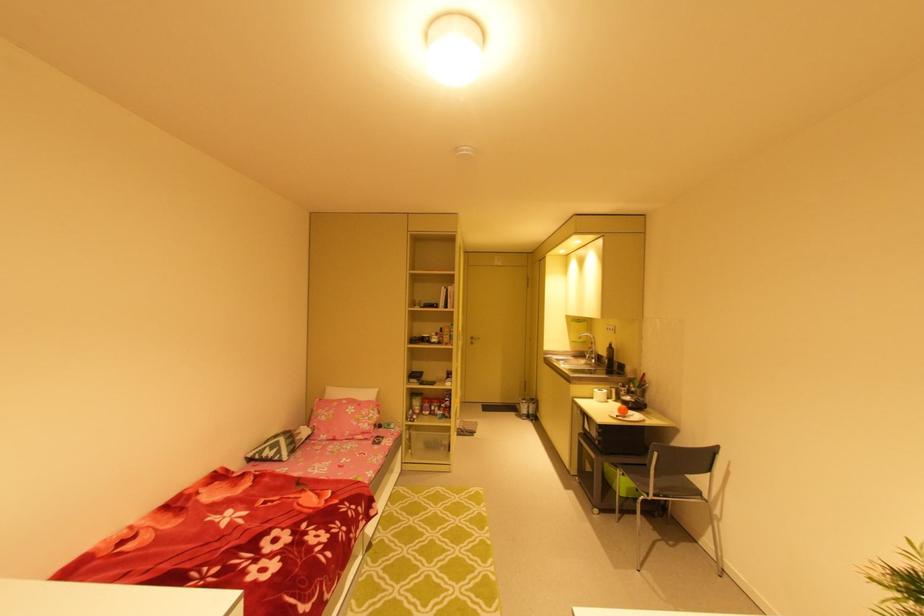
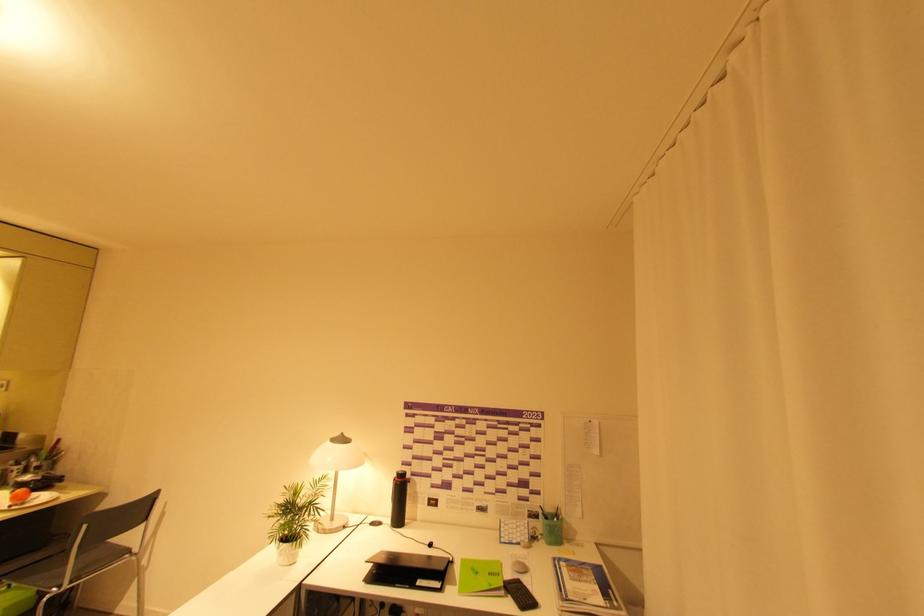
Question: The camera is either moving clockwise (left) or counter-clockwise (right) around the object. The first image is from the beginning of the video and the second image is from the end. Is the camera moving left or right when shooting the video?

Choices:
 (A) Left
 (B) Right

Answer: (A)